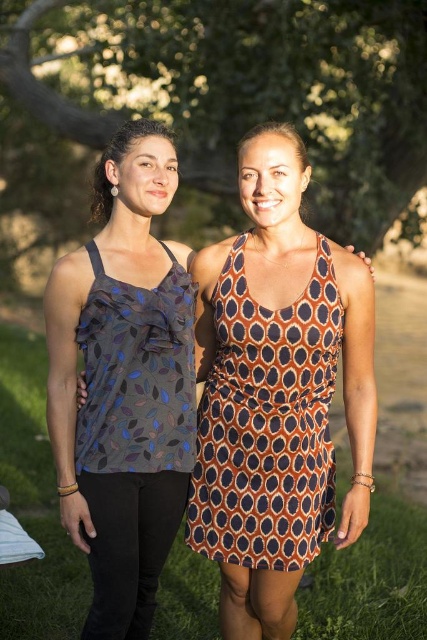
You are a fashion designer observing two women in a park setting. You notice the printed fabric tank top at left and the matte gray tank top at upper left. Which of these two tank tops is positioned higher in the image?

The printed fabric tank top at left is much taller as matte gray tank top at upper left, so the printed fabric tank top at left is positioned higher in the image.

You are a photographer setting up a shot in the park. You want to position your camera so that the green leafy tree at upper center is framed to the left of the green grass at center. Is this possible based on their current positions?

Yes, because the green leafy tree at upper center is already positioned to the left of the green grass at center, so framing it that way aligns with their existing arrangement.

You are a photographer setting up a shot in the park. You want to capture both the green leafy tree at upper center and the green grass at center in your frame. Based on their positions, which object should you focus on first to ensure both are in focus?

The green leafy tree at upper center is above the green grass at center, so you should focus on the green grass at center first to ensure both are in focus.